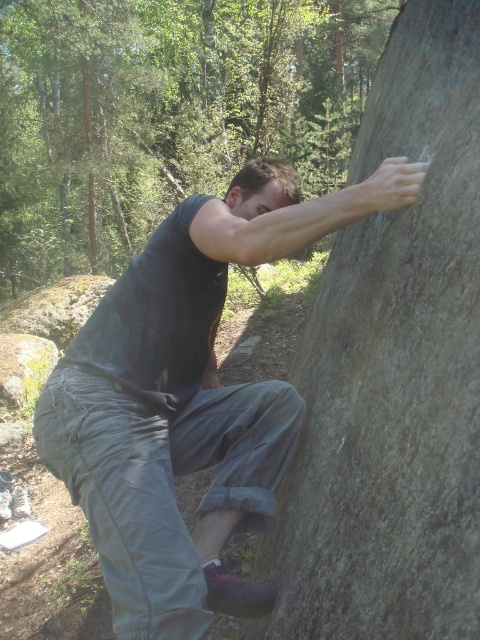
Question: Which point appears closest to the camera in this image?

Choices:
 (A) (72, 440)
 (B) (452, 385)

Answer: (B)

Question: Which point is farther to the camera?

Choices:
 (A) (430, 10)
 (B) (226, 228)

Answer: (A)

Question: Can you confirm if smooth gray rock at center is wider than dark gray fabric pants at center?

Choices:
 (A) yes
 (B) no

Answer: (B)

Question: Is smooth gray rock at center smaller than dark gray fabric pants at center?

Choices:
 (A) no
 (B) yes

Answer: (A)

Question: Can you confirm if smooth gray rock at center is wider than dark gray fabric pants at center?

Choices:
 (A) yes
 (B) no

Answer: (B)